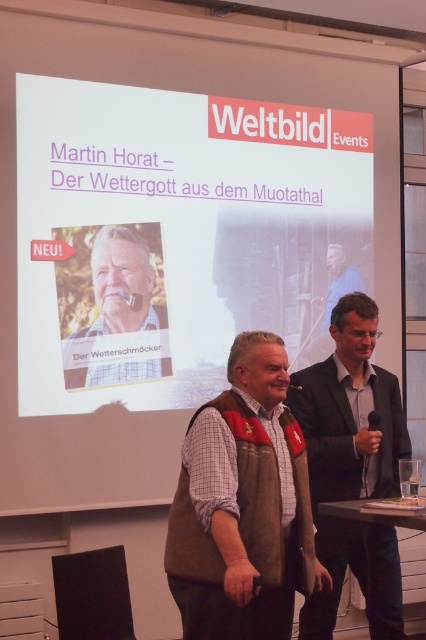
Question: Is white matte projection screen at upper center thinner than matte brown vest at center?

Choices:
 (A) yes
 (B) no

Answer: (B)

Question: Which point appears farthest from the camera in this image?

Choices:
 (A) (132, 259)
 (B) (313, 477)
 (C) (334, 273)
 (D) (222, 461)

Answer: (C)

Question: Is dark gray suit at center below matte brown vest at center?

Choices:
 (A) no
 (B) yes

Answer: (B)

Question: Among these objects, which one is nearest to the camera?

Choices:
 (A) matte black jacket at right
 (B) dark gray suit at center

Answer: (B)

Question: Among these objects, which one is farthest from the camera?

Choices:
 (A) leather vest at center
 (B) white matte projection screen at upper center
 (C) matte black jacket at right
 (D) matte brown vest at center

Answer: (C)

Question: Observing the image, what is the correct spatial positioning of white matte projection screen at upper center in reference to leather vest at center?

Choices:
 (A) below
 (B) above

Answer: (B)